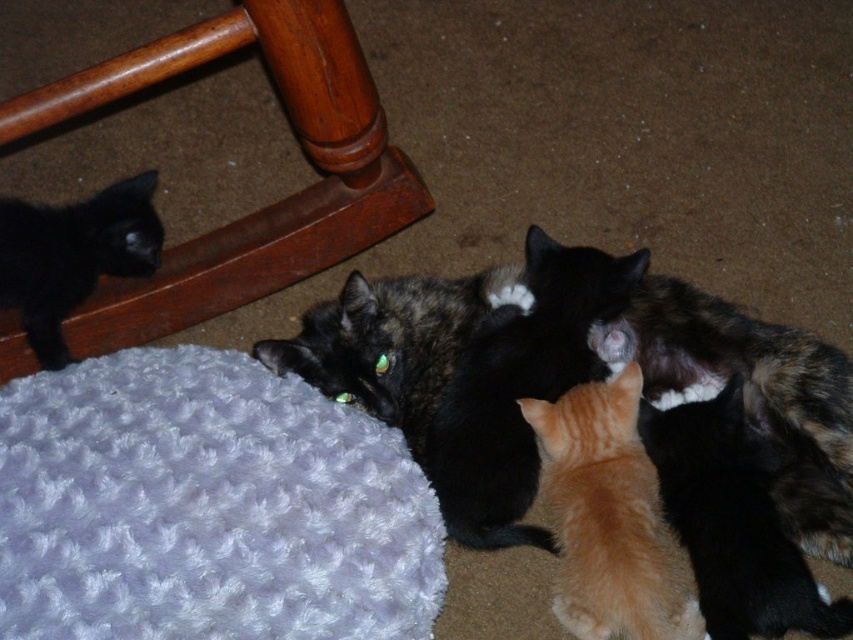
Can you confirm if black fur cat at center is positioned to the right of orange fur cat at center?

In fact, black fur cat at center is to the left of orange fur cat at center.

Who is more forward, (469, 502) or (561, 616)?

Point (561, 616)

The image size is (853, 640). I want to click on black fur cat at center, so click(520, 388).

Who is positioned more to the right, wooden rocking chair at lower left or black fur cat at center?

From the viewer's perspective, black fur cat at center appears more on the right side.

Measure the distance from wooden rocking chair at lower left to black fur cat at center.

wooden rocking chair at lower left and black fur cat at center are 14.04 inches apart.

Is point (125, 317) positioned behind point (461, 451)?

Yes, point (125, 317) is farther from viewer.

You are a GUI agent. You are given a task and a screenshot of the screen. Output one action in this format:
    pyautogui.click(x=<x>, y=<y>)
    Task: Click on the wooden rocking chair at lower left
    
    Given the screenshot: What is the action you would take?
    pyautogui.click(x=265, y=205)

Does fluffy orange kitten at center appear under black fur cat at left?

Correct, fluffy orange kitten at center is located below black fur cat at left.

Who is more distant from viewer, (508, 417) or (148, 205)?

The point (148, 205) is more distant.

Identify the location of fluffy orange kitten at center. (x=573, y=378).